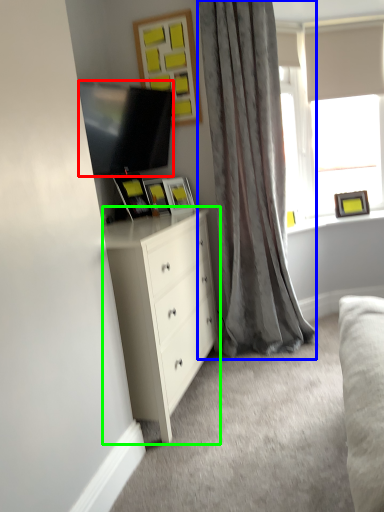
Question: Based on their relative distances, which object is farther from television (highlighted by a red box)? Choose from curtain (highlighted by a blue box) and chest of drawers (highlighted by a green box).

Choices:
 (A) curtain
 (B) chest of drawers

Answer: (B)